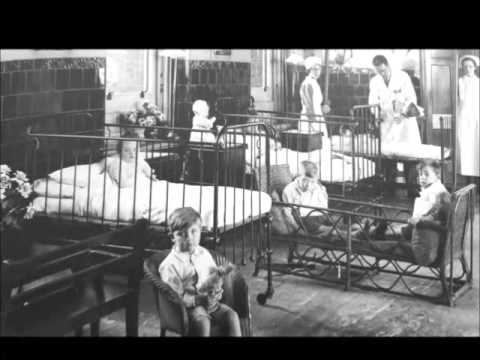
The image size is (480, 360). I want to click on crib, so click(x=67, y=197), click(x=190, y=199), click(x=232, y=200), click(x=352, y=154), click(x=283, y=157).